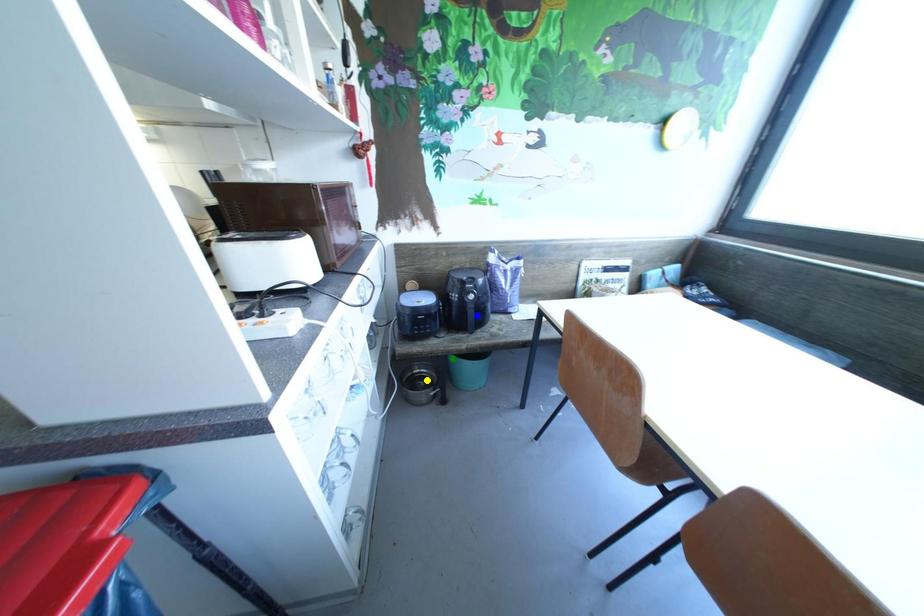
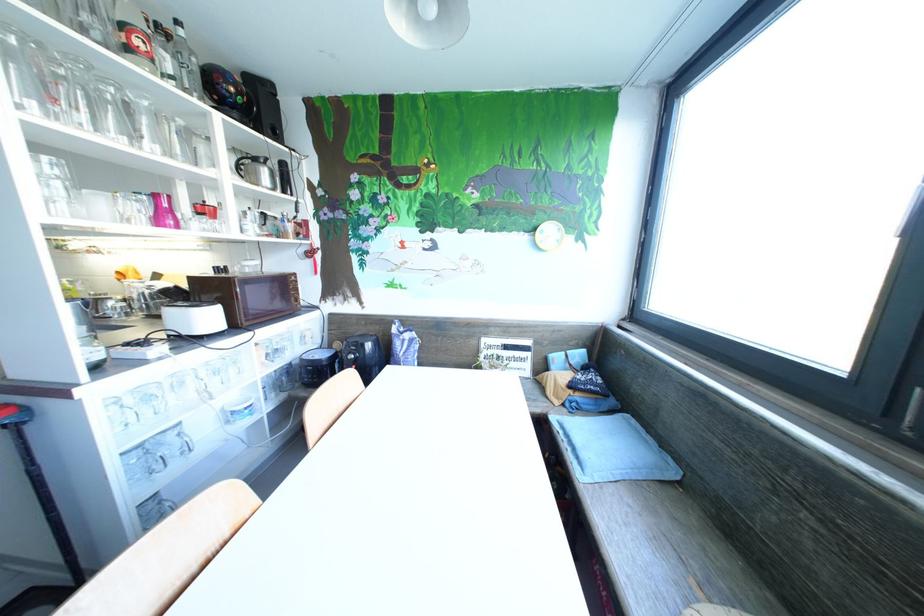
I am providing you with two images of the same scene from different viewpoints. Three points are marked in image1. Which point corresponds to a part or object that is occluded in image2?In image1, three points are marked. Which of them correspond to a part or object that is occluded in image2?Among the three points shown in image1, which one corresponds to a part or object that is no longer visible due to occlusion in image2?

yellow point, green point, blue point cannot be seen in image2.